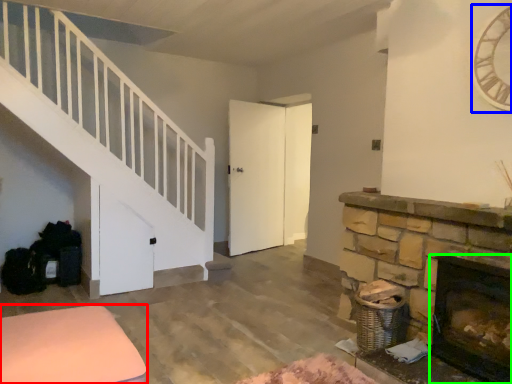
Question: Which object is positioned closest to furniture (highlighted by a red box)? Select from clock (highlighted by a blue box) and fireplace (highlighted by a green box).

Choices:
 (A) clock
 (B) fireplace

Answer: (B)